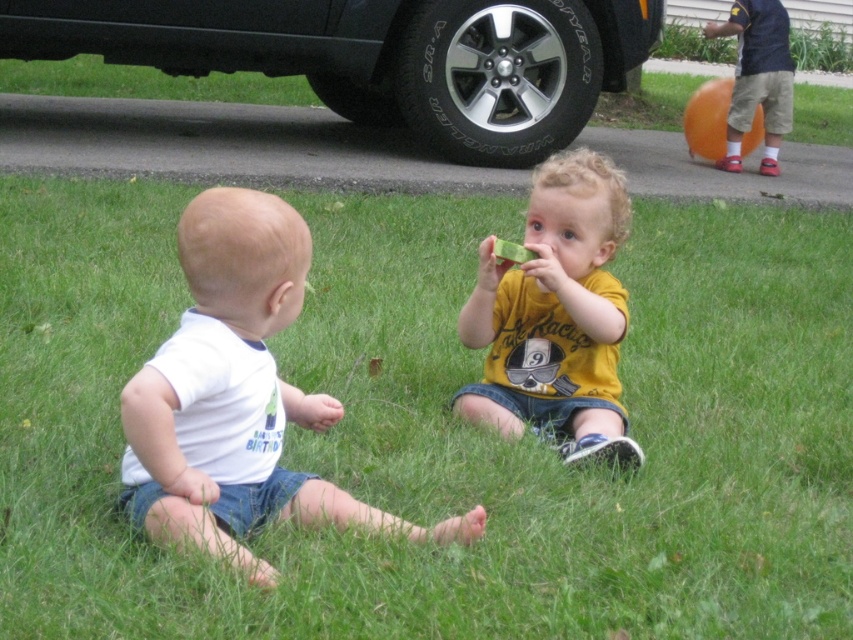
Based on the photo, you are a photographer setting up for a family photo. You need to ensure that the white cotton onesie at lower left and the black rubber tire at center are both visible in the frame. Based on their sizes, which object might require more careful positioning to ensure it doesn

The white cotton onesie at lower left occupies less space than the black rubber tire at center. Since the onesie is smaller, it might require more careful positioning to ensure it is clearly visible in the frame compared to the larger tire.

You are a photographer setting up a photo shoot for two children wearing different shirts. The scene includes the white cotton onesie at lower left and the yellow matte shirt at center. Which child should stand closer to the camera to ensure both shirts are visible in the frame?

The white cotton onesie at lower left has a lesser height compared to yellow matte shirt at center. To ensure both shirts are visible, the child in the white cotton onesie at lower left should stand closer to the camera since they are shorter, allowing their shirt to appear larger in the frame and balance the visibility with the taller yellow matte shirt at center.

You are a parent trying to hand a toy to your children. The white cotton onesie at lower left is your younger child and the yellow matte shirt at center is your older child. Which child should you give the toy to first if you want to give it to the closer one?

The white cotton onesie at lower left is closer to you because the distance between them is 38.88 inches, so you should give the toy to the white cotton onesie at lower left first.